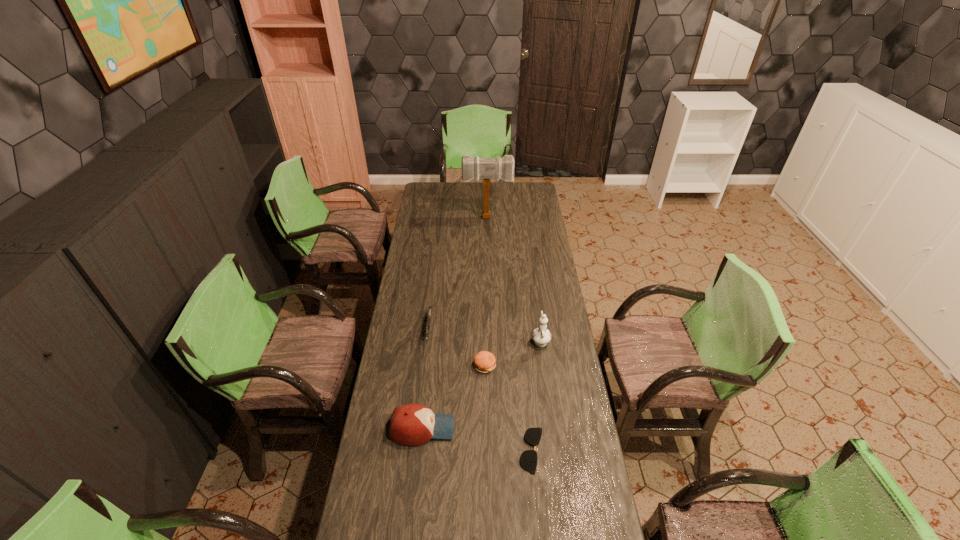
The image size is (960, 540). What are the coordinates of `free area in between the fourth shortest object and the tallest object` in the screenshot? It's located at (455, 323).

This screenshot has width=960, height=540. In order to click on vacant area that lies between the hamburger and the spectacles in this screenshot , I will do `click(508, 408)`.

Image resolution: width=960 pixels, height=540 pixels. I want to click on free space between the spectacles and the third tallest object, so click(477, 440).

Where is `the fourth closest object relative to the shortest object`? the fourth closest object relative to the shortest object is located at coordinates (430, 308).

The height and width of the screenshot is (540, 960). What are the coordinates of `object that can be found as the closest to the hamburger` in the screenshot? It's located at (541, 335).

Find the location of a particular element. Image resolution: width=960 pixels, height=540 pixels. vacant space that satisfies the following two spatial constraints: 1. on the front side of the spectacles; 2. on the right side of the farthest object is located at coordinates (492, 450).

Find the location of a particular element. free region that satisfies the following two spatial constraints: 1. on the back side of the mallet; 2. on the left side of the hamburger is located at coordinates (483, 218).